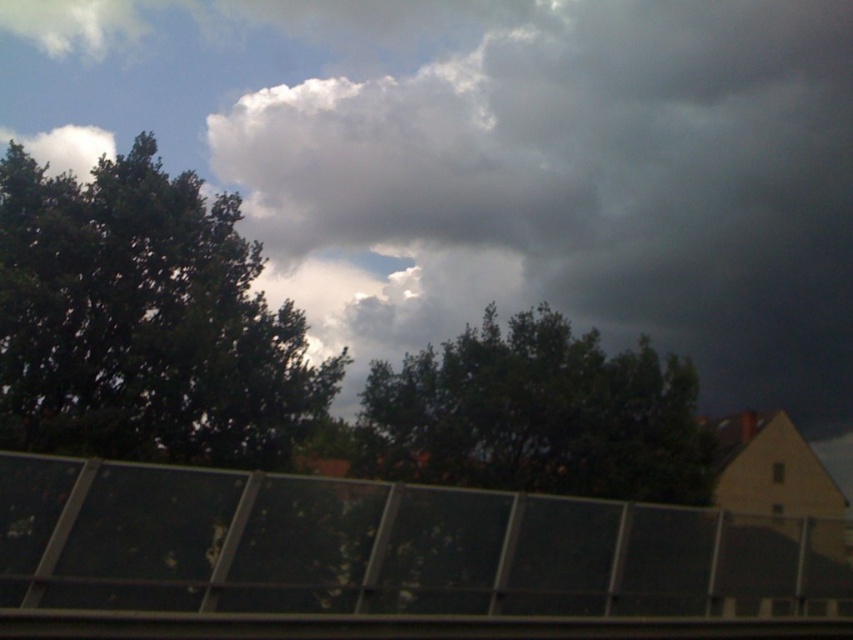
Question: Is dark gray cloud at upper center thinner than green leafy tree at left?

Choices:
 (A) yes
 (B) no

Answer: (B)

Question: Can you confirm if green leafy tree at left is positioned below dark green leafy tree at center?

Choices:
 (A) no
 (B) yes

Answer: (A)

Question: Is green leafy tree at left below dark green leafy tree at center?

Choices:
 (A) no
 (B) yes

Answer: (A)

Question: Which is farther from the dark gray cloud at upper center?

Choices:
 (A) dark green leafy tree at center
 (B) green leafy tree at left

Answer: (B)

Question: Which of the following is the closest to the observer?

Choices:
 (A) (1, 230)
 (B) (373, 394)
 (C) (285, 29)

Answer: (A)

Question: Which point is farther from the camera taking this photo?

Choices:
 (A) (274, 115)
 (B) (589, 484)
 (C) (105, 321)

Answer: (A)